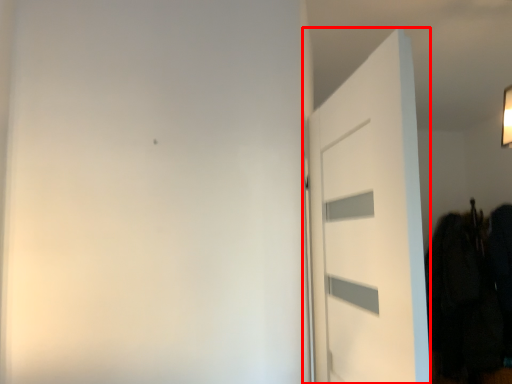
Question: Observing the image, what is the correct spatial positioning of door (annotated by the red box) in reference to clothing?

Choices:
 (A) right
 (B) left

Answer: (B)